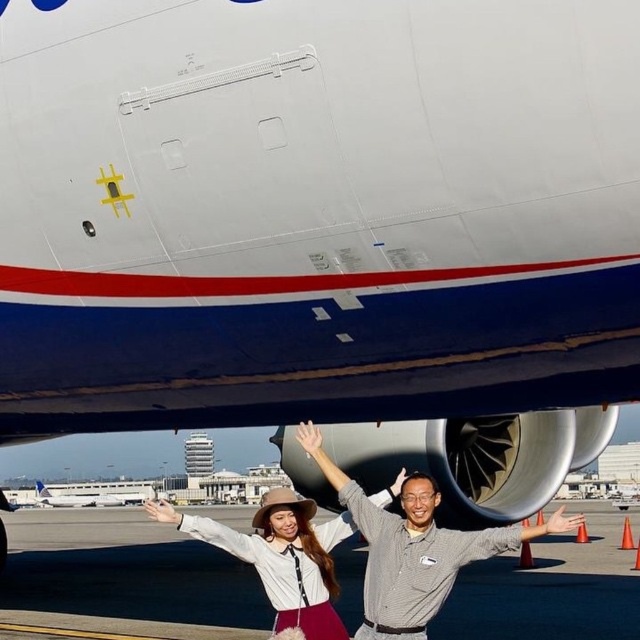
Question: Observing the image, what is the correct spatial positioning of white matte arm at center in reference to matte gray shirt at center?

Choices:
 (A) above
 (B) below

Answer: (B)

Question: Estimate the real-world distances between objects in this image. Which object is farther from the matte gray shirt at center?

Choices:
 (A) matte white blouse at center
 (B) gray striped shirt at center
 (C) white matte arm at center
 (D) white matte airplane at center

Answer: (D)

Question: Which is nearer to the matte white blouse at center?

Choices:
 (A) smooth asphalt tarmac at center
 (B) white matte arm at center
 (C) matte gray shirt at center
 (D) gray striped shirt at center

Answer: (D)

Question: In this image, where is matte white blouse at center located relative to matte gray shirt at center?

Choices:
 (A) left
 (B) right

Answer: (A)

Question: Estimate the real-world distances between objects in this image. Which object is closer to the matte gray shirt at center?

Choices:
 (A) gray striped shirt at center
 (B) white matte airplane at center
 (C) white matte arm at center
 (D) smooth gray arm at center

Answer: (A)

Question: Does matte white blouse at center have a smaller size compared to smooth gray arm at center?

Choices:
 (A) no
 (B) yes

Answer: (B)